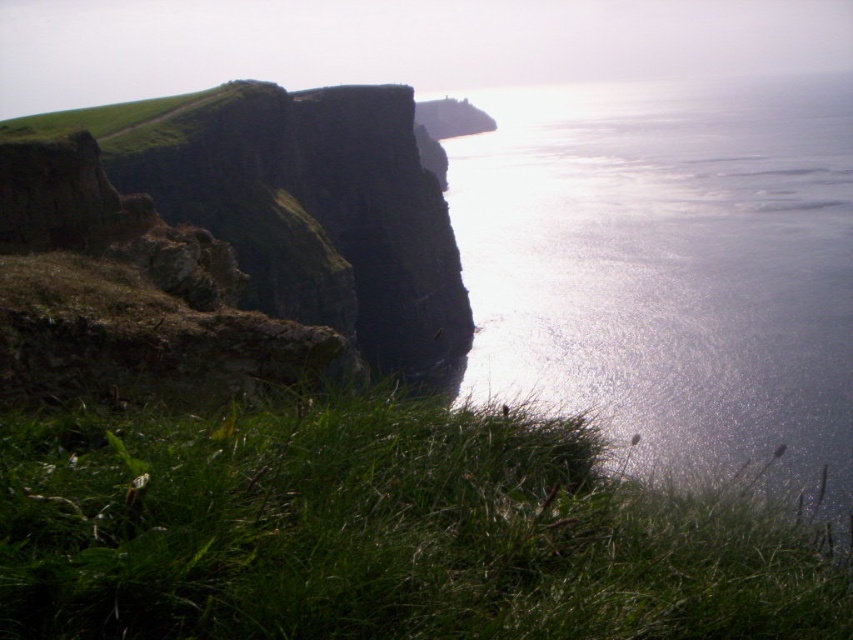
Question: From the image, what is the correct spatial relationship of green grassy at lower left in relation to shiny reflective water at upper right?

Choices:
 (A) below
 (B) above

Answer: (A)

Question: Can you confirm if green grassy at lower left is bigger than green grassy hill at upper left?

Choices:
 (A) yes
 (B) no

Answer: (B)

Question: Which point is farther to the camera?

Choices:
 (A) (422, 172)
 (B) (361, 520)
 (C) (494, 268)

Answer: (C)

Question: Which point is closer to the camera taking this photo?

Choices:
 (A) (231, 188)
 (B) (850, 189)
 (C) (593, 636)

Answer: (C)

Question: Does green grassy at lower left have a larger size compared to shiny reflective water at upper right?

Choices:
 (A) yes
 (B) no

Answer: (B)

Question: Which object is farther from the camera taking this photo?

Choices:
 (A) green grassy at lower left
 (B) green grassy hill at upper left

Answer: (B)